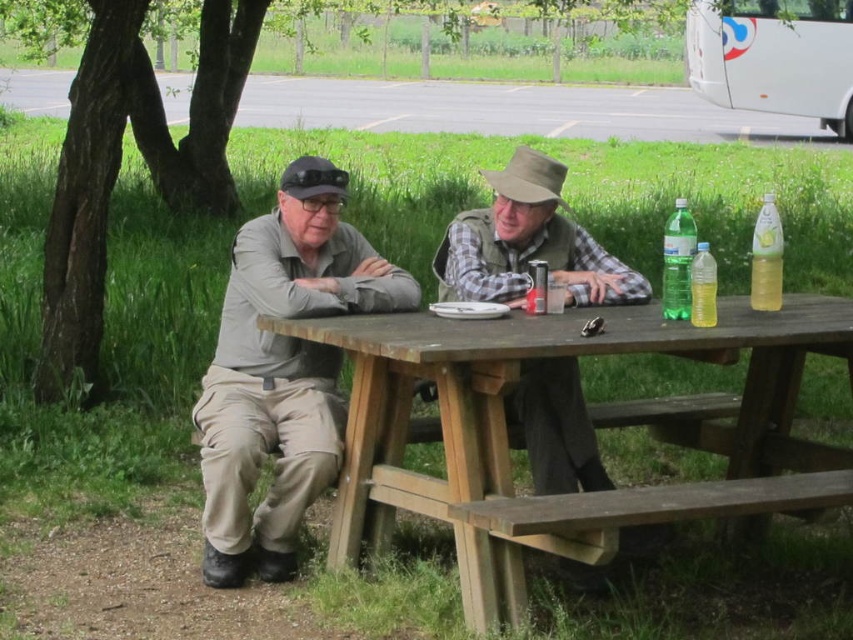
You are standing 3 meters away from the picnic table. You see the matte gray jacket at center. Can you reach it without moving closer?

The matte gray jacket at center is 4.01 meters away from you, so you cannot reach it without moving closer since you are currently 3 meters away.

You are a delivery person trying to place a small package on the wooden picnic table at center. The package is 2 inches thick. Can you place it on the table without it touching the matte gray jacket at center?

The wooden picnic table at center is not as tall as the matte gray jacket at center, so the package may not fit if the jacket is occupying space on the table. However, the question does not specify the jacket is on the table. Since the jacket is at center, it might be hanging or placed nearby. Without knowing the jacket position, it is uncertain if there is enough space.